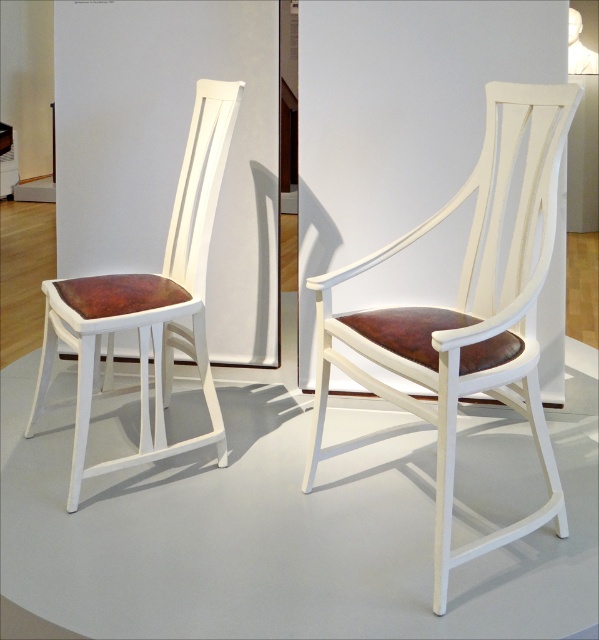
Can you confirm if matte white chair at center is wider than matte white chair at left?

No, matte white chair at center is not wider than matte white chair at left.

Can you confirm if matte white chair at center is smaller than matte white chair at left?

Incorrect, matte white chair at center is not smaller in size than matte white chair at left.

Between point (452, 202) and point (187, 282), which one is positioned behind?

The point (187, 282) is more distant.

The width and height of the screenshot is (599, 640). Identify the location of matte white chair at center. pos(465,316).